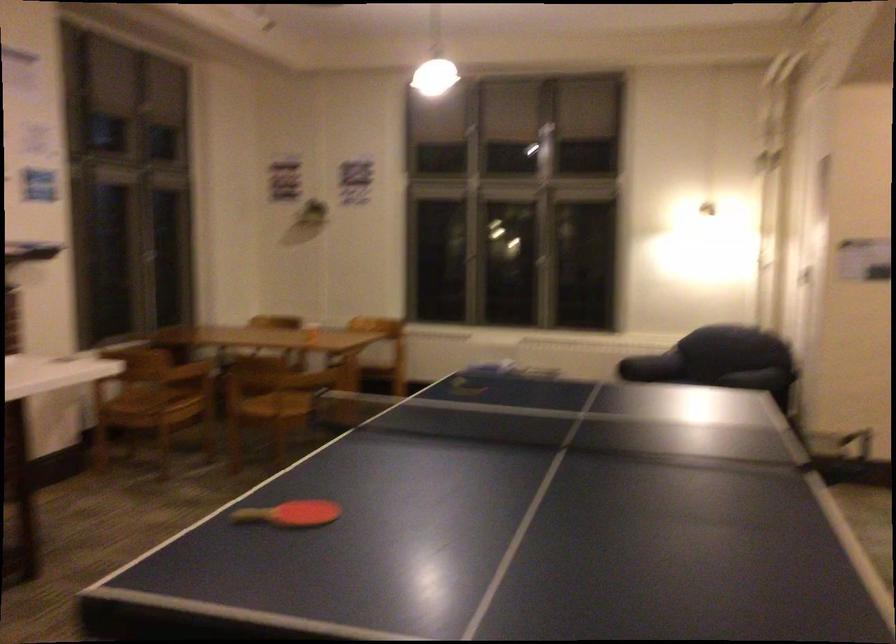
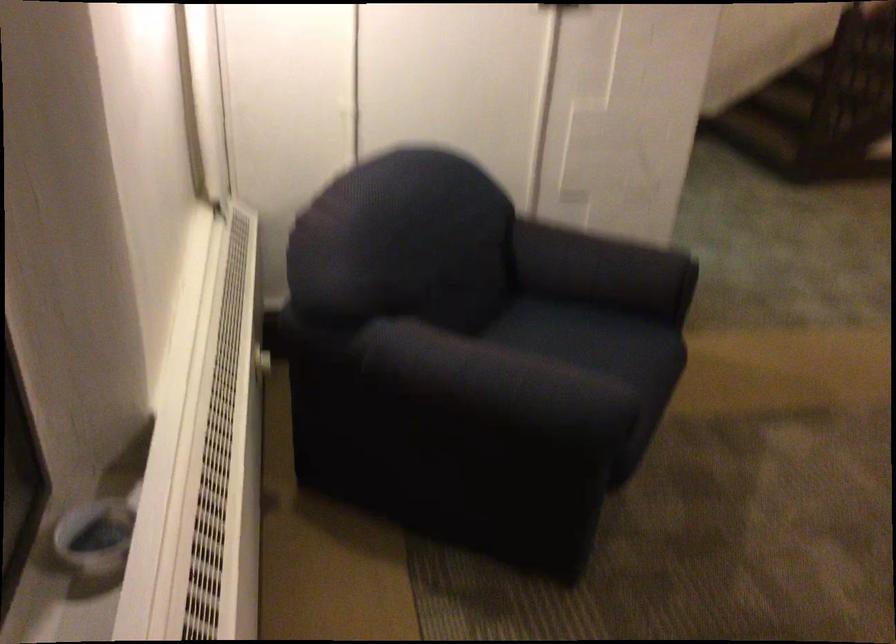
Locate, in the second image, the point that corresponds to the point at 692,377 in the first image.

(601, 355)